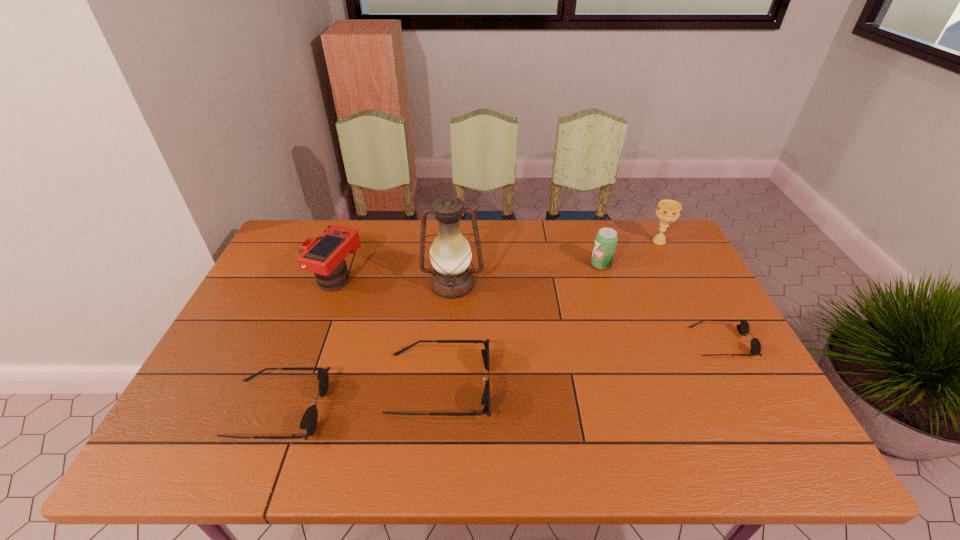
At what (x,y) coordinates should I click in order to perform the action: click on object that is the fifth nearest to the third object from right to left. Please return your answer as a coordinate pair (x, y). Looking at the image, I should click on (324, 256).

You are a GUI agent. You are given a task and a screenshot of the screen. Output one action in this format:
    pyautogui.click(x=<x>, y=<y>)
    Task: Click on the sunglasses that stands as the closest to the rightmost sunglasses
    This screenshot has width=960, height=540.
    Given the screenshot: What is the action you would take?
    pyautogui.click(x=485, y=401)

I want to click on sunglasses that can be found as the third closest to the tallest object, so click(743, 328).